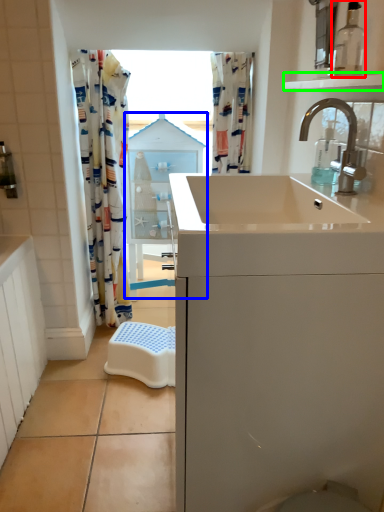
Question: Which object is the closest to the bottle (highlighted by a red box)? Choose among these: medicine cabinet (highlighted by a blue box) or balustrade (highlighted by a green box).

Choices:
 (A) medicine cabinet
 (B) balustrade

Answer: (B)